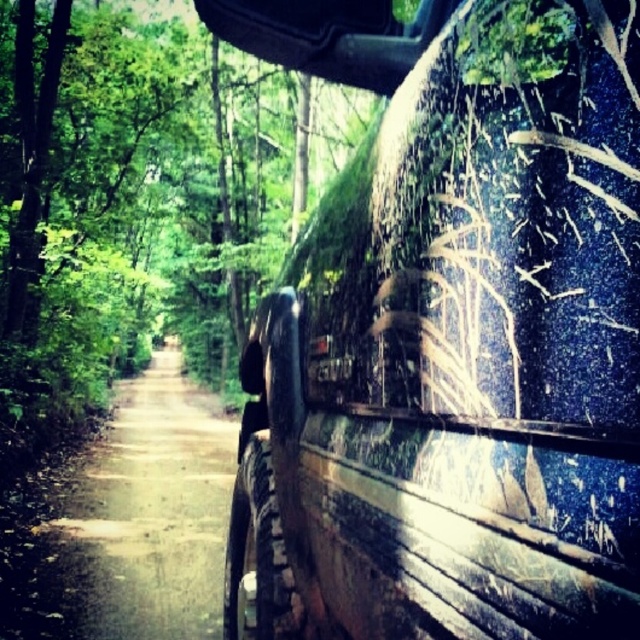
What do you see at coordinates (449, 333) in the screenshot? I see `muddy rubber tire at right` at bounding box center [449, 333].

In the scene shown: Can you confirm if muddy rubber tire at right is positioned below dirt road at center?

Incorrect, muddy rubber tire at right is not positioned below dirt road at center.

Does point (346, 445) come farther from viewer compared to point (138, 504)?

No, it is not.

The height and width of the screenshot is (640, 640). Find the location of `muddy rubber tire at right`. muddy rubber tire at right is located at coordinates (449, 333).